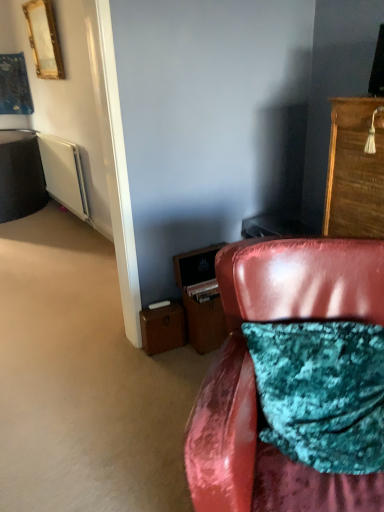
Locate an element on the screen. unoccupied region to the right of brown leather suitcase at lower left, which ranks as the 1th drawer in left-to-right order is located at coordinates (187, 356).